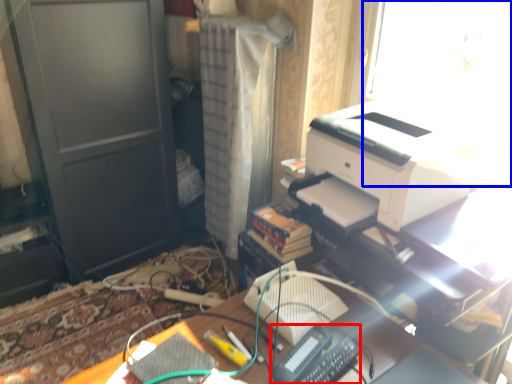
Question: Which object is further to the camera taking this photo, equipment (highlighted by a red box) or window screen (highlighted by a blue box)?

Choices:
 (A) equipment
 (B) window screen

Answer: (B)